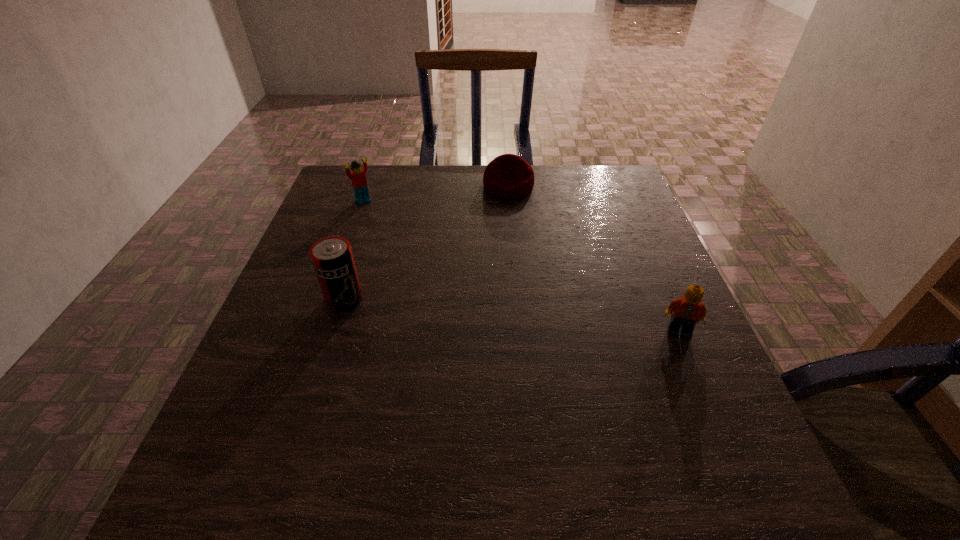
Where is `the tallest object`? the tallest object is located at coordinates (332, 258).

Where is `the second nearest object`? The height and width of the screenshot is (540, 960). the second nearest object is located at coordinates click(x=332, y=258).

You are a GUI agent. You are given a task and a screenshot of the screen. Output one action in this format:
    pyautogui.click(x=<x>, y=<y>)
    Task: Click on the rightmost object
    
    Given the screenshot: What is the action you would take?
    pyautogui.click(x=688, y=310)

The width and height of the screenshot is (960, 540). Identify the location of the nearer Lego. (688, 310).

This screenshot has height=540, width=960. Identify the location of the left Lego. (358, 178).

Identify the location of beanbag. (508, 176).

Identify the location of the shortest object. (508, 176).

The height and width of the screenshot is (540, 960). In order to click on vacant space situated on the right of the can in this screenshot , I will do `click(440, 299)`.

Locate an element on the screen. vacant region located 0.160m on the front-facing side of the right Lego is located at coordinates (713, 411).

Where is `vacant space situated on the face of the farther Lego`? The height and width of the screenshot is (540, 960). vacant space situated on the face of the farther Lego is located at coordinates (427, 259).